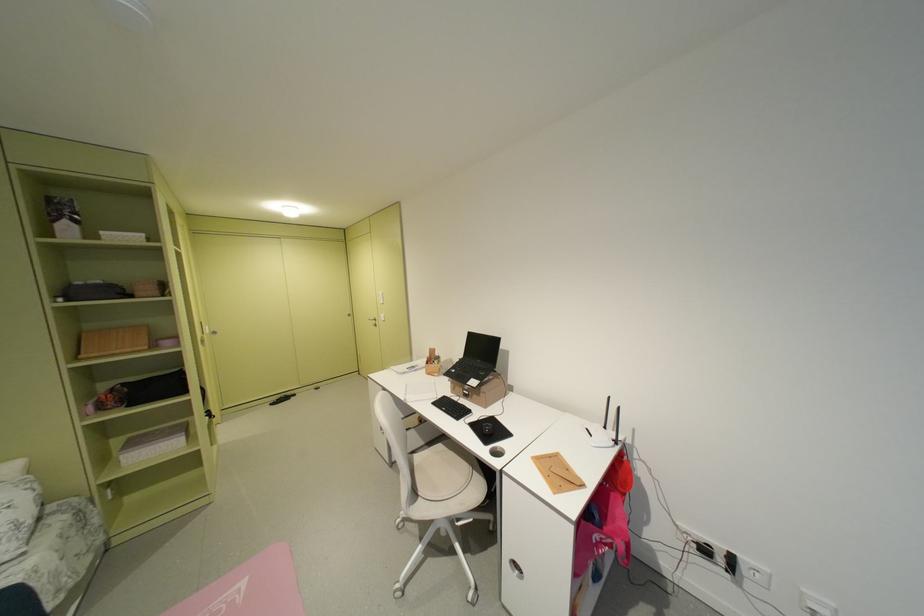
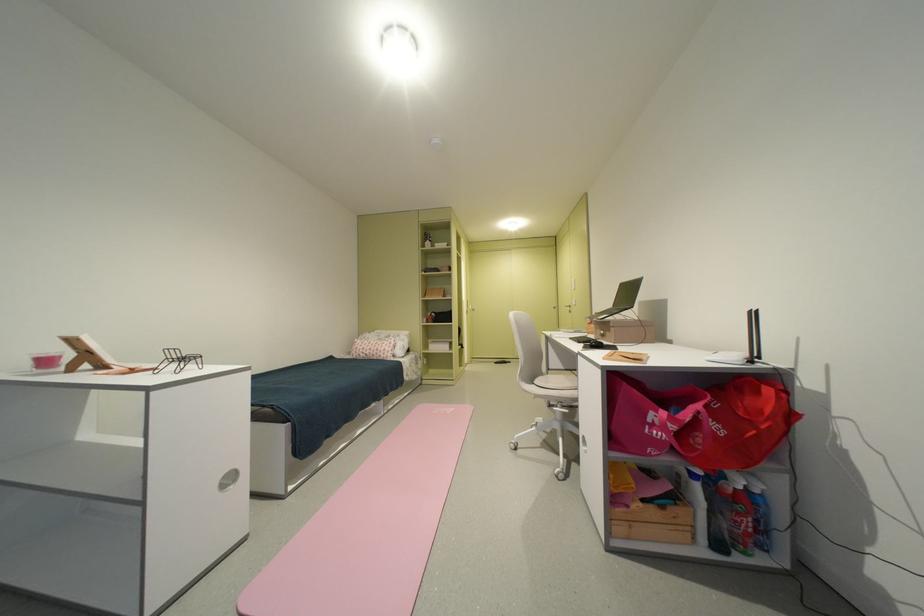
Find the pixel in the second image that matches [429,495] in the first image.

(543, 383)